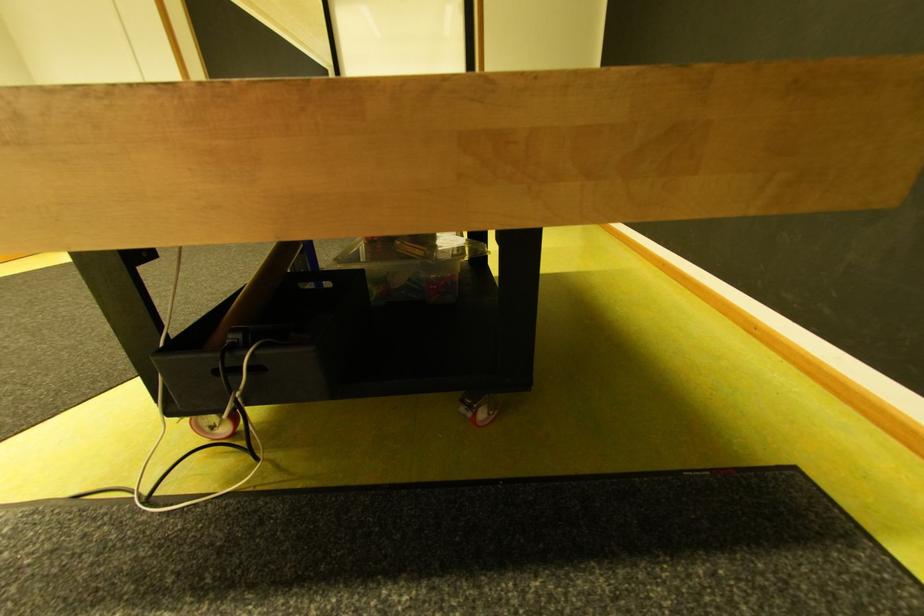
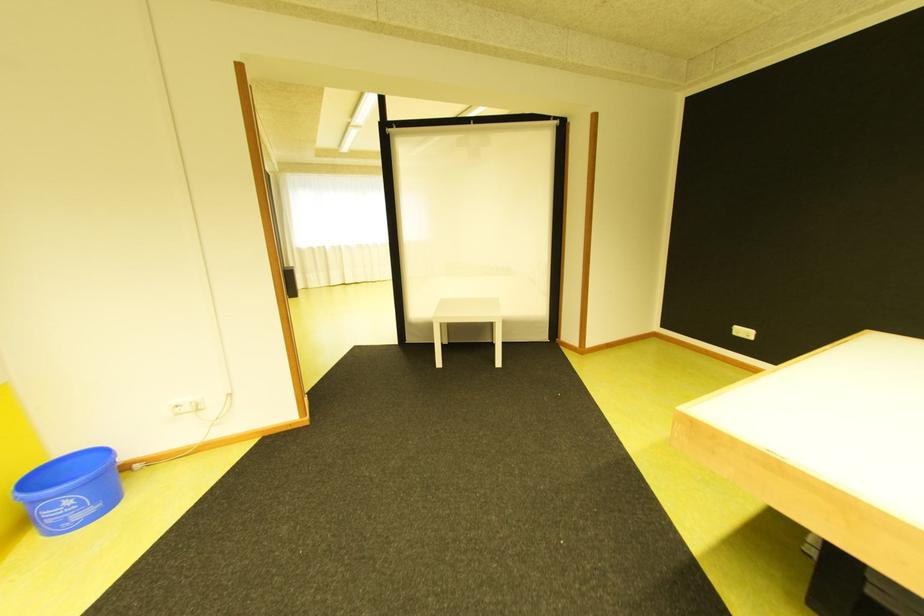
The images are taken continuously from a first-person perspective. In which direction are you moving?

The cameraman walked toward left, forward.